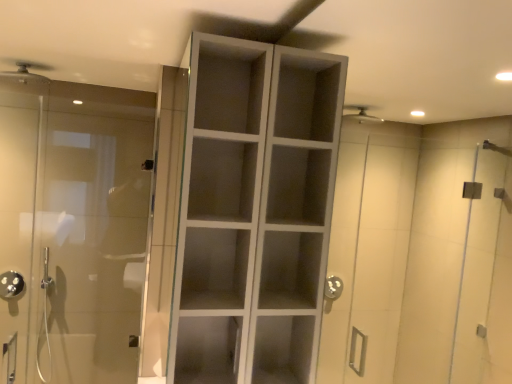
Question: Is matte silver shower head at upper left, placed as the second shower when sorted from back to front, surrounding transparent glass door at left?

Choices:
 (A) yes
 (B) no

Answer: (B)

Question: Is matte silver shower head at upper left, which is the second shower in left-to-right order, further to the viewer compared to transparent glass door at left?

Choices:
 (A) yes
 (B) no

Answer: (A)

Question: Is matte silver shower head at upper left, placed as the 1th shower when sorted from top to bottom, next to transparent glass door at left and touching it?

Choices:
 (A) yes
 (B) no

Answer: (B)

Question: Would you say matte silver shower head at upper left, which is the second shower in left-to-right order, is outside transparent glass door at left?

Choices:
 (A) yes
 (B) no

Answer: (A)

Question: Does matte silver shower head at upper left, placed as the 1th shower when sorted from top to bottom, have a lesser width compared to transparent glass door at left?

Choices:
 (A) yes
 (B) no

Answer: (B)

Question: Is matte silver shower head at upper left, placed as the second shower when sorted from back to front, to the right of transparent glass door at left from the viewer's perspective?

Choices:
 (A) yes
 (B) no

Answer: (B)

Question: Is matte silver shower head at upper left, acting as the 2th shower starting from the bottom, positioned with its back to polished chrome showerhead at left, which appears as the first shower when viewed from the back?

Choices:
 (A) no
 (B) yes

Answer: (A)

Question: From a real-world perspective, is matte silver shower head at upper left, acting as the 2th shower starting from the bottom, beneath polished chrome showerhead at left, which is the first shower from left to right?

Choices:
 (A) yes
 (B) no

Answer: (B)

Question: Are matte silver shower head at upper left, which is counted as the first shower, starting from the front, and polished chrome showerhead at left, which is the first shower from left to right, far apart?

Choices:
 (A) no
 (B) yes

Answer: (B)

Question: Is matte silver shower head at upper left, which is the second shower in left-to-right order, at the left side of polished chrome showerhead at left, which is the first shower from left to right?

Choices:
 (A) no
 (B) yes

Answer: (A)

Question: Considering the relative sizes of matte silver shower head at upper left, placed as the 1th shower when sorted from top to bottom, and polished chrome showerhead at left, which appears as the first shower when viewed from the back, in the image provided, is matte silver shower head at upper left, placed as the 1th shower when sorted from top to bottom, wider than polished chrome showerhead at left, which appears as the first shower when viewed from the back,?

Choices:
 (A) no
 (B) yes

Answer: (B)

Question: Could polished chrome showerhead at left, arranged as the second shower when viewed from the right, be considered to be inside matte silver shower head at upper left, placed as the second shower when sorted from back to front?

Choices:
 (A) yes
 (B) no

Answer: (B)

Question: Does white matte cabinet at center have a lesser height compared to matte silver shower head at upper left, placed as the 1th shower when sorted from top to bottom?

Choices:
 (A) yes
 (B) no

Answer: (B)